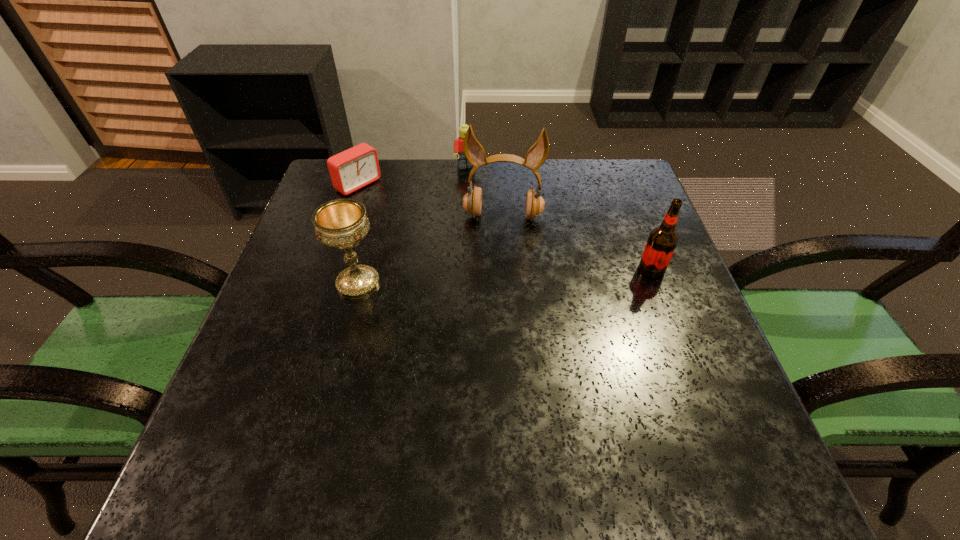
Image resolution: width=960 pixels, height=540 pixels. Identify the location of alarm clock at the far edge. (357, 167).

Identify the location of earphone positioned at the far edge. This screenshot has height=540, width=960. (474, 152).

Find the location of `chalice that is at the left edge`. chalice that is at the left edge is located at coordinates (341, 223).

The image size is (960, 540). I want to click on alarm clock located at the left edge, so click(357, 167).

Find the location of a particular element. object that is at the right edge is located at coordinates (662, 240).

Identify the location of object at the far left corner. (357, 167).

In the image, there is a desktop. At what (x,y) coordinates should I click in order to perform the action: click on blank space at the far edge. Please return your answer as a coordinate pair (x, y). The image size is (960, 540). Looking at the image, I should click on (447, 189).

This screenshot has width=960, height=540. Find the location of `free space at the near edge of the desktop`. free space at the near edge of the desktop is located at coordinates (515, 411).

At what (x,y) coordinates should I click in order to perform the action: click on vacant space at the left edge of the desktop. Please return your answer as a coordinate pair (x, y). This screenshot has width=960, height=540. Looking at the image, I should click on (267, 350).

Locate an element on the screen. The image size is (960, 540). free space at the right edge of the desktop is located at coordinates (696, 367).